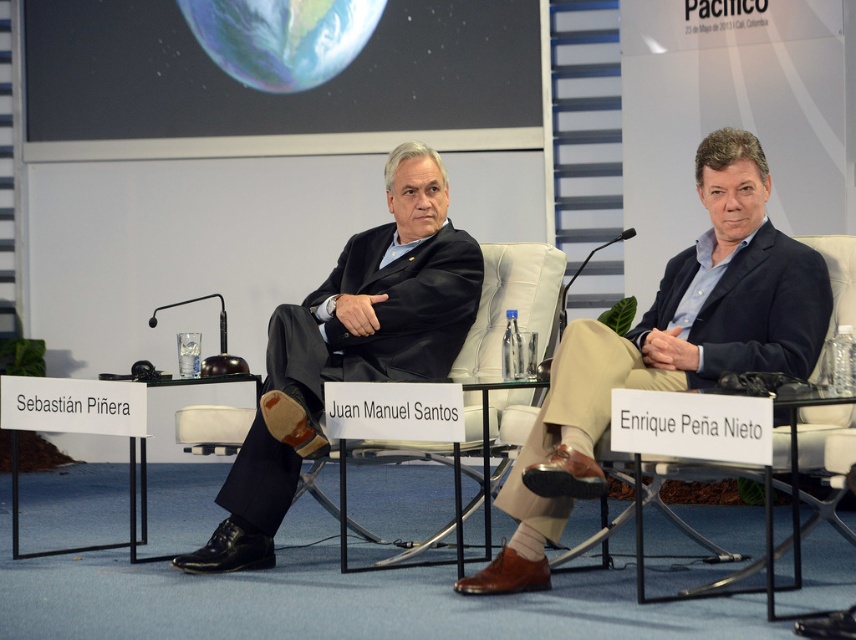
You are a photographer at the event and need to adjust the lighting to ensure both the matte black suit at center and the black matte suit at center are evenly lit. Since one is much taller than the other, which one might require more focused lighting adjustments?

The matte black suit at center is much taller than the black matte suit at center, so it might require more focused lighting adjustments to ensure proper illumination given its height.

You are an event photographer trying to capture a closeup of the person closest to the front of the stage. You have two points marked on your camera screen that correspond to the positions of two individuals on stage. Which point, point [700,160] or point [342,374], is closer to the front of the stage?

Point [700,160] is closer to the viewer than point [342,374], so the photographer should focus on point [700,160] to capture the person closest to the front of the stage.

You are an event organizer who needs to ensure seating arrangements are accurate. You observe the image and notice two black suits at the center. Which one is the larger in size between the matte black suit at center and the black matte suit at center?

The matte black suit at center is larger in size than the black matte suit at center.